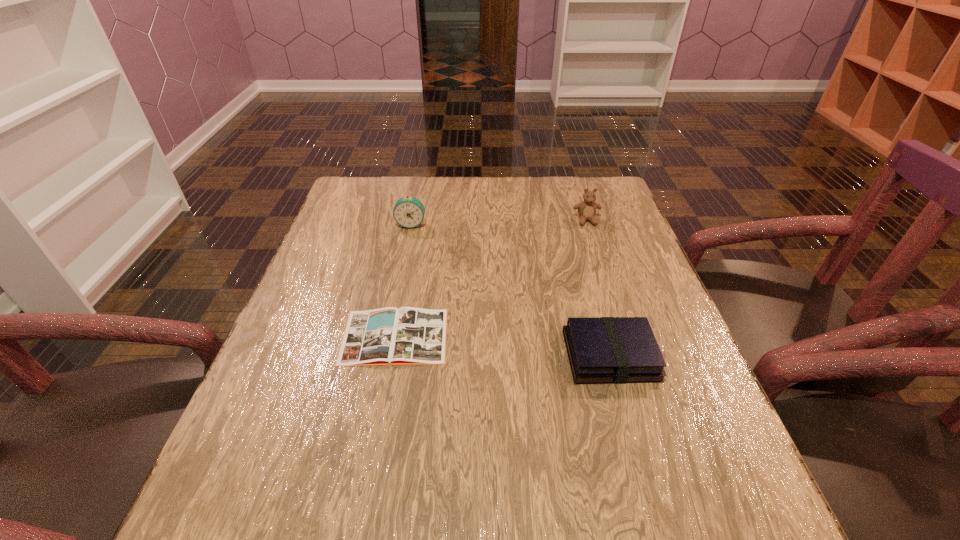
Where is `teddy bear`? This screenshot has width=960, height=540. teddy bear is located at coordinates (586, 209).

Locate an element on the screen. alarm clock is located at coordinates (409, 212).

Identify the location of the taller book. Image resolution: width=960 pixels, height=540 pixels. (601, 350).

Identify the location of the right book. (601, 350).

You are a GUI agent. You are given a task and a screenshot of the screen. Output one action in this format:
    pyautogui.click(x=<x>, y=<y>)
    Task: Click on the left book
    This screenshot has height=540, width=960.
    Given the screenshot: What is the action you would take?
    pyautogui.click(x=387, y=336)

This screenshot has width=960, height=540. Find the location of `the shortest object`. the shortest object is located at coordinates (387, 336).

The height and width of the screenshot is (540, 960). Find the location of `vacant region located on the front-facing side of the teddy bear`. vacant region located on the front-facing side of the teddy bear is located at coordinates (593, 242).

I want to click on free space located 0.180m on the front-facing side of the alarm clock, so click(401, 272).

I want to click on vacant space positioned 0.390m on the left of the third tallest object, so click(370, 355).

This screenshot has width=960, height=540. Find the location of `free space located on the front of the left book`. free space located on the front of the left book is located at coordinates (378, 423).